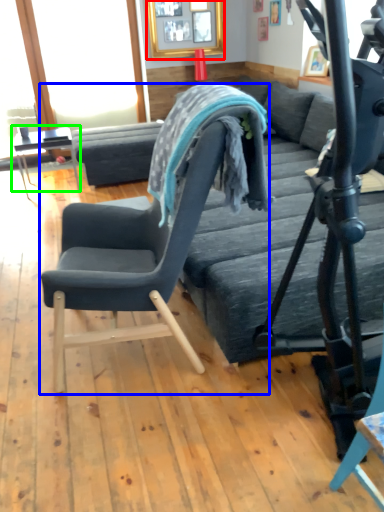
Question: Which object is the farthest from picture frame (highlighted by a red box)? Choose among these: chair (highlighted by a blue box) or table (highlighted by a green box).

Choices:
 (A) chair
 (B) table

Answer: (A)